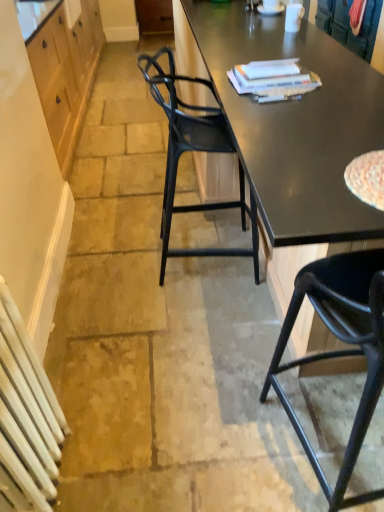
Locate an element on the screen. spots to the right of white painted metal radiator at lower left is located at coordinates (113, 461).